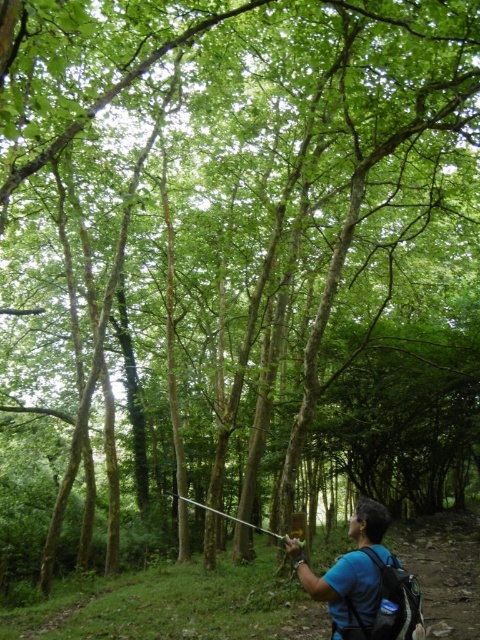
Question: Is blue fabric backpack at lower right positioned before metallic silver fishing pole at center?

Choices:
 (A) yes
 (B) no

Answer: (A)

Question: Is blue fabric backpack at lower right further to the viewer compared to metallic silver fishing pole at center?

Choices:
 (A) no
 (B) yes

Answer: (A)

Question: Which point is farther to the camera?

Choices:
 (A) (274, 536)
 (B) (316, 595)

Answer: (A)

Question: Which of the following is the closest to the observer?

Choices:
 (A) blue fabric backpack at lower right
 (B) metallic silver fishing pole at center

Answer: (A)

Question: Is blue fabric backpack at lower right below metallic silver fishing pole at center?

Choices:
 (A) yes
 (B) no

Answer: (B)